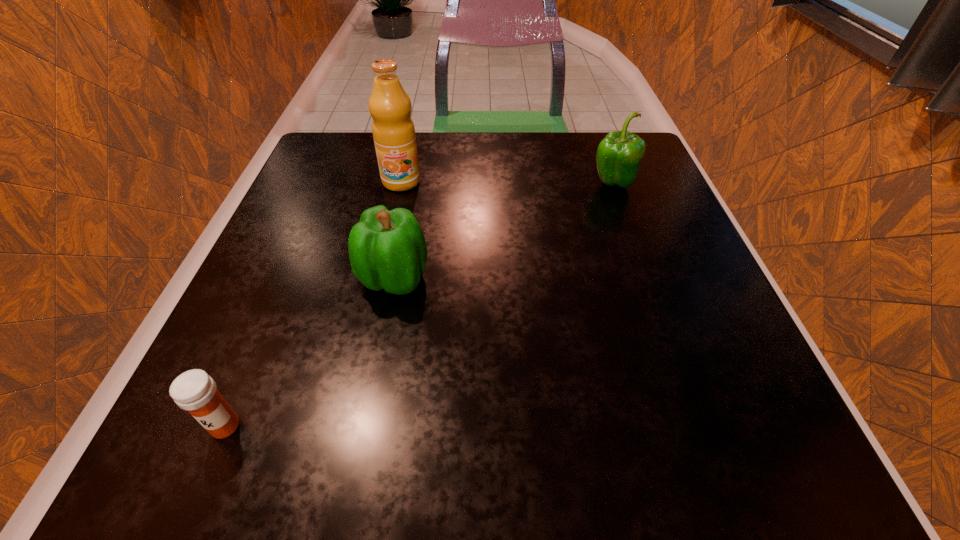
Locate an element on the screen. Image resolution: width=960 pixels, height=540 pixels. fruit juice that is at the far edge is located at coordinates (393, 130).

The height and width of the screenshot is (540, 960). Identify the location of bell pepper at the far edge. (619, 154).

Locate an element on the screen. object situated at the near edge is located at coordinates (194, 390).

Identify the location of object situated at the left edge. (194, 390).

In order to click on object at the right edge in this screenshot , I will do `click(619, 154)`.

Identify the location of object located in the near left corner section of the desktop. (194, 390).

Find the location of `object located in the far right corner section of the desktop`. object located in the far right corner section of the desktop is located at coordinates (619, 154).

Find the location of a particular element. The image size is (960, 540). vacant point at the far edge is located at coordinates (525, 148).

Where is `blank area at the left edge`? The height and width of the screenshot is (540, 960). blank area at the left edge is located at coordinates (294, 399).

This screenshot has width=960, height=540. I want to click on free space at the right edge of the desktop, so click(618, 292).